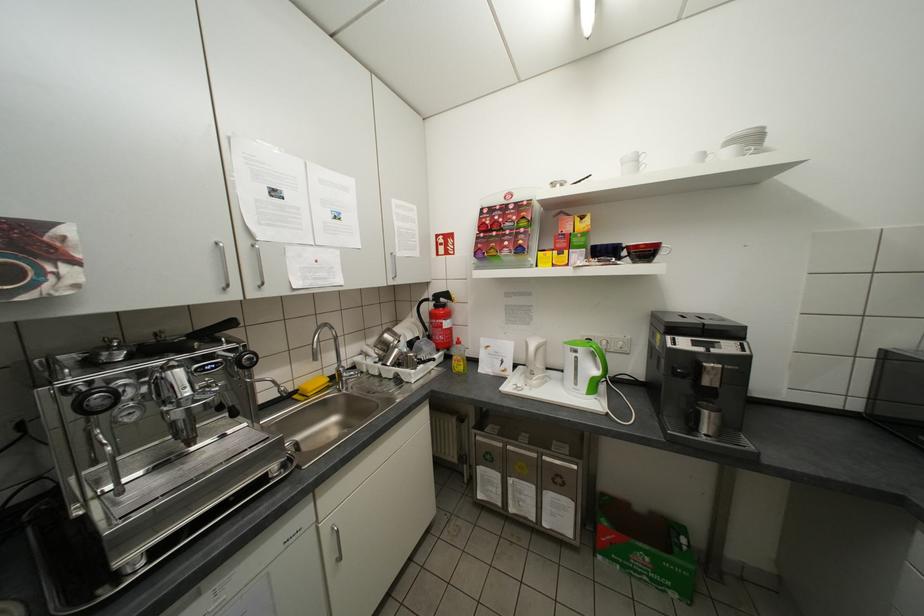
Locate an element on the screen. faucet handle is located at coordinates (330, 352).